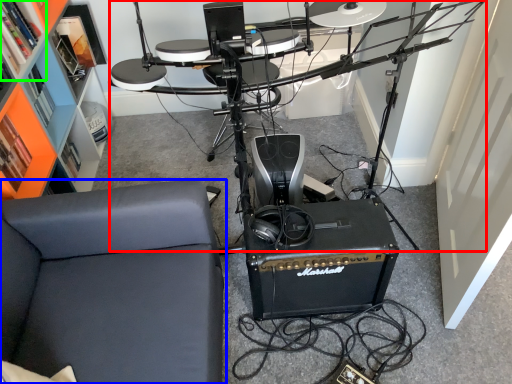
Question: Estimate the real-world distances between objects in this image. Which object is farther from computer desk (highlighted by a red box), furniture (highlighted by a blue box) or shelf (highlighted by a green box)?

Choices:
 (A) furniture
 (B) shelf

Answer: (B)